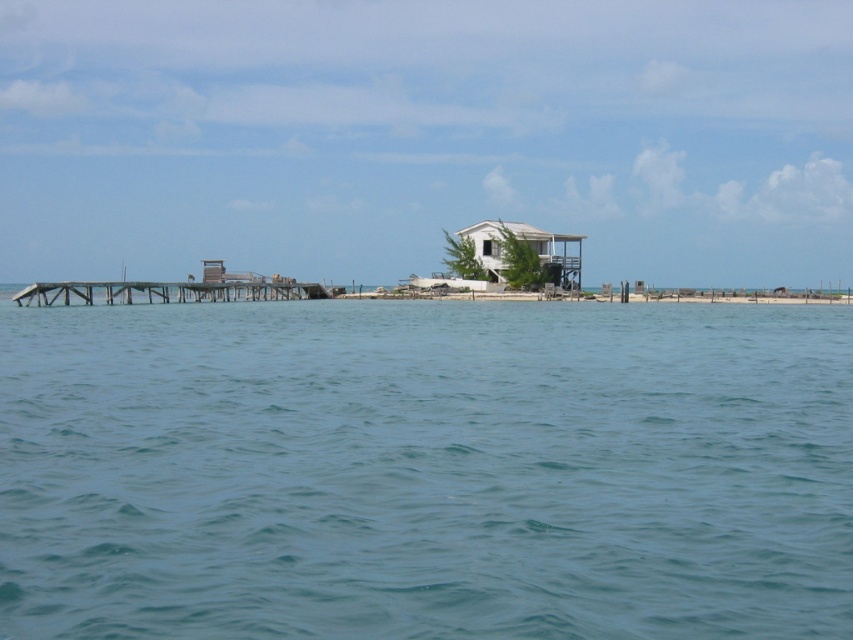
Between point (631, 589) and point (62, 305), which one is positioned behind?

The point (62, 305) is more distant.

Looking at this image, can you confirm if clear blue water at center is positioned to the left of wooden pier at left?

Incorrect, clear blue water at center is not on the left side of wooden pier at left.

Between point (701, 499) and point (160, 296), which one is positioned behind?

The point (160, 296) is behind.

This screenshot has height=640, width=853. In order to click on clear blue water at center in this screenshot , I will do `click(425, 470)`.

Is clear blue water at center below white matte house at center?

Correct, clear blue water at center is located below white matte house at center.

Who is shorter, clear blue water at center or white matte house at center?

With less height is clear blue water at center.

Is point (595, 500) closer to camera compared to point (492, 260)?

Yes.

Where is `clear blue water at center`? This screenshot has width=853, height=640. clear blue water at center is located at coordinates (425, 470).

Can you confirm if wooden pier at left is thinner than white matte house at center?

In fact, wooden pier at left might be wider than white matte house at center.

Can you confirm if wooden pier at left is bigger than white matte house at center?

Yes, wooden pier at left is bigger than white matte house at center.

Identify the location of wooden pier at left. (161, 292).

Find the location of a particular element. wooden pier at left is located at coordinates (161, 292).